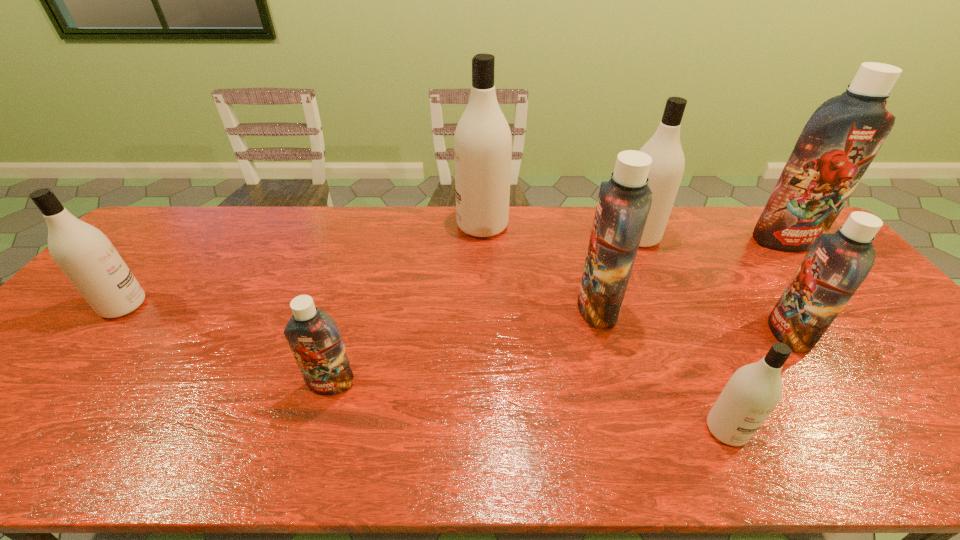
Where is `the biggest white shampoo`? the biggest white shampoo is located at coordinates (482, 145).

Where is `the third shampoo from left to right`? the third shampoo from left to right is located at coordinates (482, 145).

In order to click on the rightmost shampoo in this screenshot , I will do `click(842, 137)`.

The width and height of the screenshot is (960, 540). What are the coordinates of `the farthest blue shampoo` in the screenshot? It's located at (842, 137).

The width and height of the screenshot is (960, 540). Find the location of `the third smallest white shampoo`. the third smallest white shampoo is located at coordinates (666, 171).

This screenshot has width=960, height=540. Identify the location of the fourth shampoo from left to right. (624, 202).

Image resolution: width=960 pixels, height=540 pixels. In order to click on the second blue shampoo from left to right in this screenshot , I will do `click(624, 202)`.

The height and width of the screenshot is (540, 960). Find the location of `the seventh object from left to right`. the seventh object from left to right is located at coordinates (836, 265).

Find the location of a particular element. This screenshot has height=540, width=960. the third biggest blue shampoo is located at coordinates 836,265.

This screenshot has height=540, width=960. What are the coordinates of `the second nearest white shampoo` in the screenshot? It's located at (87, 257).